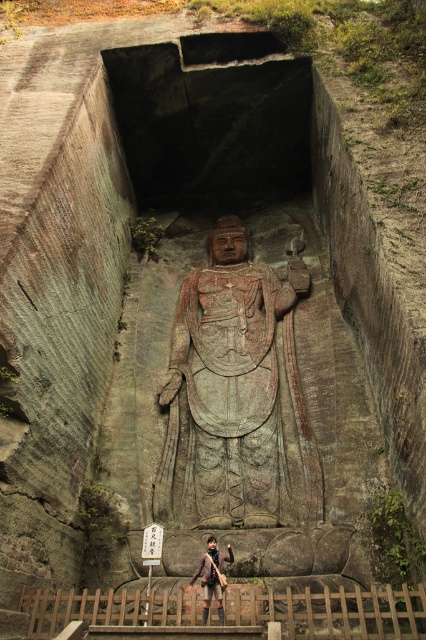
Is gray stone statue at center to the left of brown leather jacket at lower center from the viewer's perspective?

Incorrect, gray stone statue at center is not on the left side of brown leather jacket at lower center.

Which is more to the right, gray stone statue at center or brown leather jacket at lower center?

gray stone statue at center

Is point (181, 515) closer to camera compared to point (207, 586)?

That is False.

Locate an element on the screen. This screenshot has height=640, width=426. gray stone statue at center is located at coordinates click(233, 396).